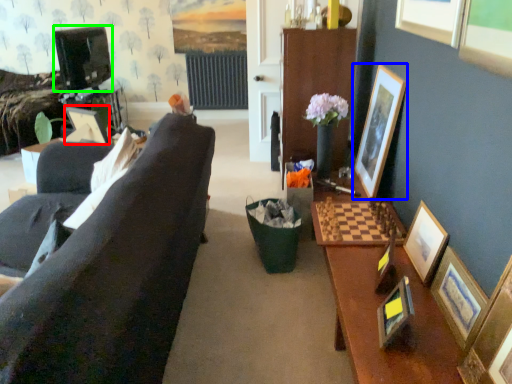
Question: Considering the real-world distances, which object is farthest from picture frame (highlighted by a red box)? picture frame (highlighted by a blue box) or television (highlighted by a green box)?

Choices:
 (A) picture frame
 (B) television

Answer: (B)